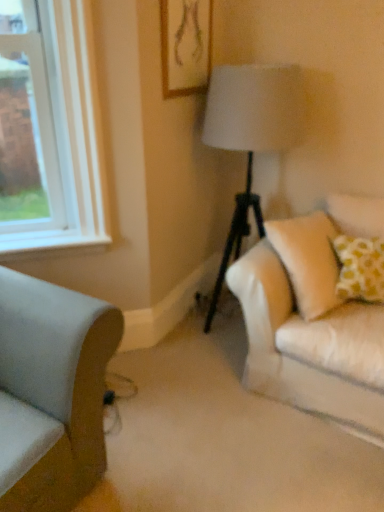
Identify the location of wooden framed artwork at upper center. This screenshot has width=384, height=512. (185, 46).

Identify the location of white smooth window sill at left. (53, 246).

Describe the element at coordinates (56, 383) in the screenshot. I see `light gray fabric couch at lower left` at that location.

You are a GUI agent. You are given a task and a screenshot of the screen. Output one action in this format:
    pyautogui.click(x=<x>, y=<y>)
    Task: Click on the wooden framed artwork at upper center
    The image size is (384, 512).
    Given the screenshot: What is the action you would take?
    pyautogui.click(x=185, y=46)

Can you confirm if white smooth window sill at left is positioned to the right of wooden framed artwork at upper center?

Incorrect, white smooth window sill at left is not on the right side of wooden framed artwork at upper center.

Is white smooth window sill at left turned away from wooden framed artwork at upper center?

No, white smooth window sill at left's orientation is not away from wooden framed artwork at upper center.

Can you tell me how much white smooth window sill at left and wooden framed artwork at upper center differ in facing direction?

45.7 degrees.

Relative to light gray fabric couch at lower left, is white smooth window sill at left in front or behind?

Clearly, white smooth window sill at left is behind light gray fabric couch at lower left.

Does point (49, 255) come in front of point (68, 391)?

No, (49, 255) is behind (68, 391).

Measure the distance from white smooth window sill at left to light gray fabric couch at lower left.

28.43 inches.

From the picture: From the image's perspective, which is above, white smooth window sill at left or light gray fabric couch at lower left?

white smooth window sill at left.

From a real-world perspective, is wooden framed artwork at upper center located higher than white smooth window sill at left?

Correct, in the physical world, wooden framed artwork at upper center is higher than white smooth window sill at left.

Identify the location of picture frame that appears on the right of white smooth window sill at left. The width and height of the screenshot is (384, 512). (185, 46).

Does wooden framed artwork at upper center appear on the left side of white smooth window sill at left?

No, wooden framed artwork at upper center is not to the left of white smooth window sill at left.

Which object is wider, light gray fabric couch at lower left or white smooth window sill at left?

With larger width is light gray fabric couch at lower left.

From a real-world perspective, is light gray fabric couch at lower left over white smooth window sill at left?

Incorrect, from a real-world perspective, light gray fabric couch at lower left is lower than white smooth window sill at left.

Is light gray fabric couch at lower left turned away from white smooth window sill at left?

That's not correct — light gray fabric couch at lower left is not looking away from white smooth window sill at left.

From a real-world perspective, is wooden framed artwork at upper center under light gray fabric couch at lower left?

No, from a real-world perspective, wooden framed artwork at upper center is not beneath light gray fabric couch at lower left.

Is the position of wooden framed artwork at upper center less distant than that of light gray fabric couch at lower left?

No, wooden framed artwork at upper center is further to the viewer.

Can you see wooden framed artwork at upper center touching light gray fabric couch at lower left?

wooden framed artwork at upper center and light gray fabric couch at lower left are not in contact.

From the image's perspective, which object appears higher, wooden framed artwork at upper center or light gray fabric couch at lower left?

wooden framed artwork at upper center appears higher in the image.

Which point is more distant from viewer, (10, 372) or (184, 0)?

The point (184, 0) is farther.

Is light gray fabric couch at lower left oriented towards wooden framed artwork at upper center?

No, light gray fabric couch at lower left is not facing towards wooden framed artwork at upper center.

Who is smaller, light gray fabric couch at lower left or wooden framed artwork at upper center?

wooden framed artwork at upper center.

Considering the sizes of light gray fabric couch at lower left and wooden framed artwork at upper center in the image, is light gray fabric couch at lower left taller or shorter than wooden framed artwork at upper center?

In the image, light gray fabric couch at lower left appears to be taller than wooden framed artwork at upper center.

Identify the location of picture frame on the right of white smooth window sill at left. The height and width of the screenshot is (512, 384). coord(185,46).

You are a GUI agent. You are given a task and a screenshot of the screen. Output one action in this format:
    pyautogui.click(x=<x>, y=<y>)
    Task: Click on the studio couch on the left of white smooth window sill at left
    The width and height of the screenshot is (384, 512).
    Given the screenshot: What is the action you would take?
    pyautogui.click(x=56, y=383)

Based on their spatial positions, is wooden framed artwork at upper center or light gray fabric couch at lower left further from white smooth window sill at left?

wooden framed artwork at upper center.

When comparing their distances from light gray fabric couch at lower left, does wooden framed artwork at upper center or white smooth window sill at left seem closer?

white smooth window sill at left is closer to light gray fabric couch at lower left.

Looking at the image, which one is located further to wooden framed artwork at upper center, light gray fabric couch at lower left or white smooth window sill at left?

The object further to wooden framed artwork at upper center is light gray fabric couch at lower left.

Which object lies further to the anchor point light gray fabric couch at lower left, white smooth window sill at left or wooden framed artwork at upper center?

wooden framed artwork at upper center lies further to light gray fabric couch at lower left than the other object.

Looking at the image, which one is located closer to white smooth window sill at left, light gray fabric couch at lower left or wooden framed artwork at upper center?

light gray fabric couch at lower left.

When comparing their distances from wooden framed artwork at upper center, does white smooth window sill at left or light gray fabric couch at lower left seem closer?

white smooth window sill at left is positioned closer to the anchor wooden framed artwork at upper center.

The width and height of the screenshot is (384, 512). What are the coordinates of `window sill that lies between wooden framed artwork at upper center and light gray fabric couch at lower left from top to bottom` in the screenshot? It's located at (53, 246).